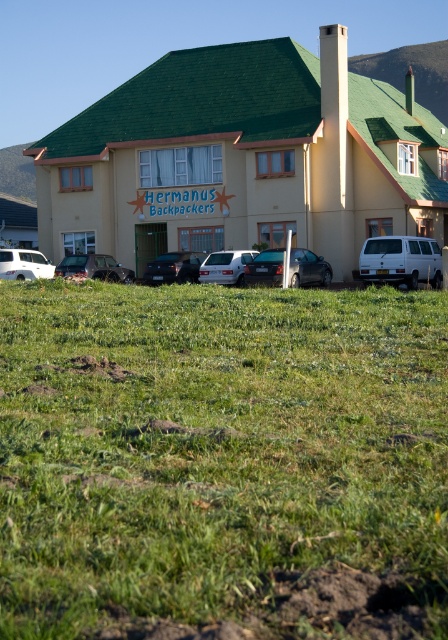
You are standing in front of the two story building with a green tiled roof and cream colored walls. You see a point labeled as point (x=94, y=268). What is located at that point?

At point (x=94, y=268) lies metallic silver car at center.

You are a visitor arriving at Hermanus Backpackers and need to park your car. You see the green grass at lower center and the metallic silver sedan at center. Which direction should you drive to avoid the grass?

You should drive to the left of the metallic silver sedan at center to avoid the green grass at lower center, since the grass is located to the right of the sedan.

You are a delivery person trying to park your truck, which is 2 meters wide, in the parking area near the building. There is a metallic silver car at center and a white matte van at center. Can your truck fit between these two vehicles if they are parked side by side?

The metallic silver car at center is thinner than the white matte van at center. Since the truck is 2 meters wide, you need to check the combined width of both vehicles. However, without knowing their exact widths, it is impossible to determine if the space between them is sufficient. Please measure the space before attempting to park.